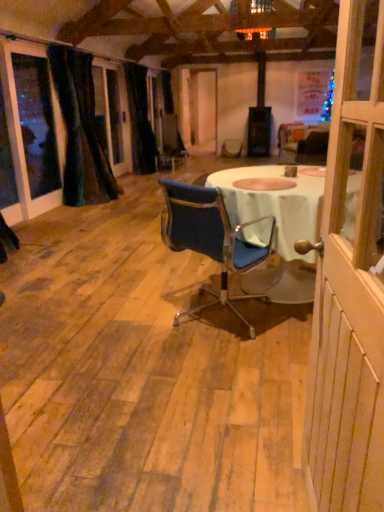
Question: From the image's perspective, is blue fabric chair at center on velvet dark green curtain at left, placed as the 1th curtain when sorted from front to back?

Choices:
 (A) yes
 (B) no

Answer: (B)

Question: Is blue fabric chair at center thinner than velvet dark green curtain at left, placed as the 1th curtain when sorted from front to back?

Choices:
 (A) no
 (B) yes

Answer: (A)

Question: Considering the relative positions of blue fabric chair at center and velvet dark green curtain at left, placed as the 1th curtain when sorted from front to back, in the image provided, is blue fabric chair at center to the left of velvet dark green curtain at left, placed as the 1th curtain when sorted from front to back, from the viewer's perspective?

Choices:
 (A) no
 (B) yes

Answer: (A)

Question: Is blue fabric chair at center in front of velvet dark green curtain at left, placed as the 1th curtain when sorted from front to back?

Choices:
 (A) no
 (B) yes

Answer: (B)

Question: Can you confirm if blue fabric chair at center is taller than velvet dark green curtain at left, which appears as the second curtain when viewed from the back?

Choices:
 (A) no
 (B) yes

Answer: (A)

Question: Is blue fabric chair at center positioned beyond the bounds of velvet dark green curtain at left, which appears as the second curtain when viewed from the back?

Choices:
 (A) no
 (B) yes

Answer: (B)

Question: Is blue fabric chair at center positioned with its back to white wood screen door at right?

Choices:
 (A) no
 (B) yes

Answer: (A)

Question: From a real-world perspective, is blue fabric chair at center under white wood screen door at right?

Choices:
 (A) no
 (B) yes

Answer: (B)

Question: Does blue fabric chair at center have a larger size compared to white wood screen door at right?

Choices:
 (A) no
 (B) yes

Answer: (B)

Question: Is blue fabric chair at center next to white wood screen door at right?

Choices:
 (A) no
 (B) yes

Answer: (A)

Question: From the image's perspective, is blue fabric chair at center on top of white wood screen door at right?

Choices:
 (A) no
 (B) yes

Answer: (B)

Question: Considering the relative sizes of blue fabric chair at center and white wood screen door at right in the image provided, is blue fabric chair at center wider than white wood screen door at right?

Choices:
 (A) yes
 (B) no

Answer: (A)

Question: Is velvet dark green curtain at left, placed as the 1th curtain when sorted from front to back, positioned behind black velvet curtain at left, which is counted as the 2th curtain, starting from the front?

Choices:
 (A) no
 (B) yes

Answer: (A)